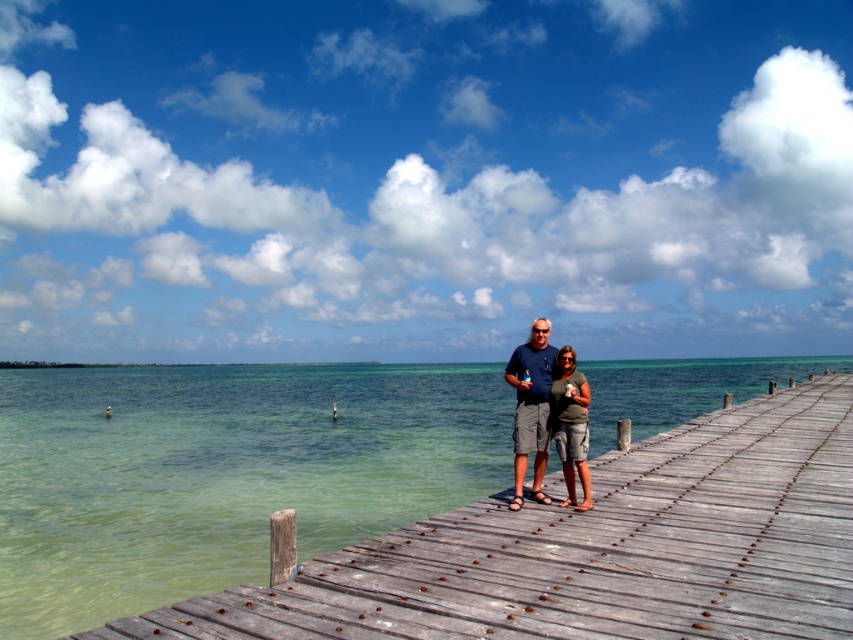
Is wooden dock at center smaller than green cotton shirt at center?

No, wooden dock at center is not smaller than green cotton shirt at center.

Between point (728, 614) and point (573, 394), which one is positioned in front?

Point (728, 614)

Find the location of a particular element. This screenshot has height=640, width=853. wooden dock at center is located at coordinates (596, 548).

Does point (550, 360) come behind point (558, 397)?

Yes.

This screenshot has height=640, width=853. What are the coordinates of `matte gray shorts at center` in the screenshot? It's located at pyautogui.click(x=531, y=406).

Is wooden dock at center below matte gray shorts at center?

Yes.

Is wooden dock at center positioned before matte gray shorts at center?

That is True.

At what (x,y) coordinates should I click in order to perform the action: click on wooden dock at center. Please return your answer as a coordinate pair (x, y). The height and width of the screenshot is (640, 853). Looking at the image, I should click on (596, 548).